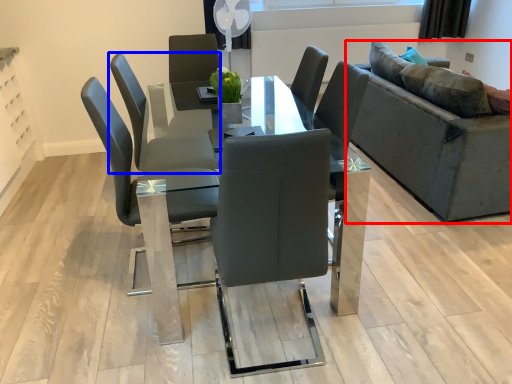
Question: Which object is closer to the camera taking this photo, studio couch (highlighted by a red box) or chair (highlighted by a blue box)?

Choices:
 (A) studio couch
 (B) chair

Answer: (B)